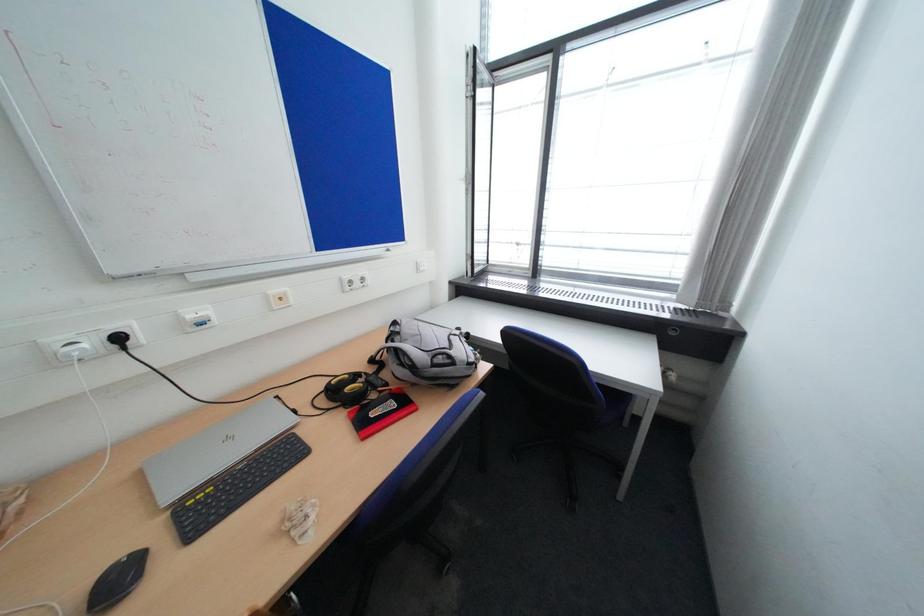
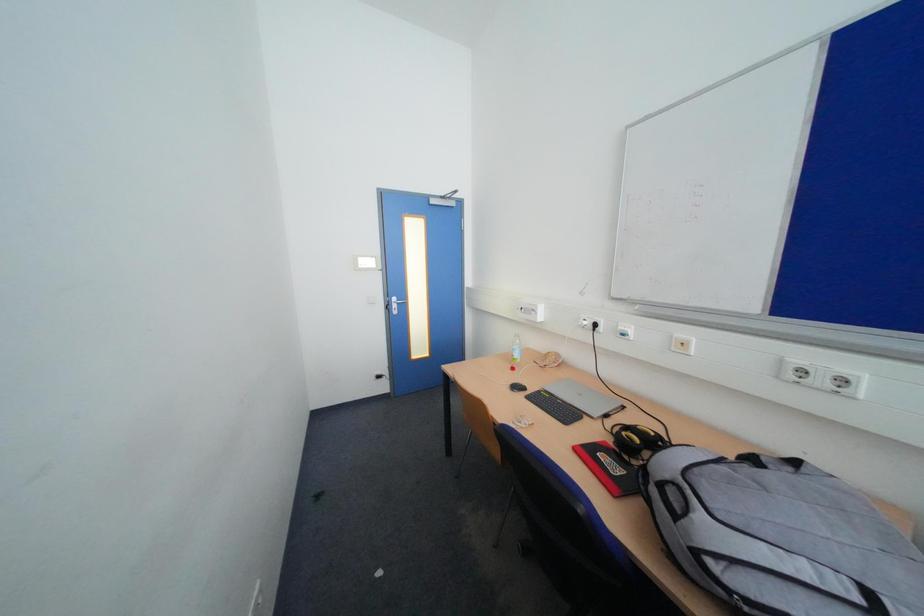
The first image is from the beginning of the video and the second image is from the end. How did the camera likely rotate when shooting the video?

The rotation direction of the camera is left-down.